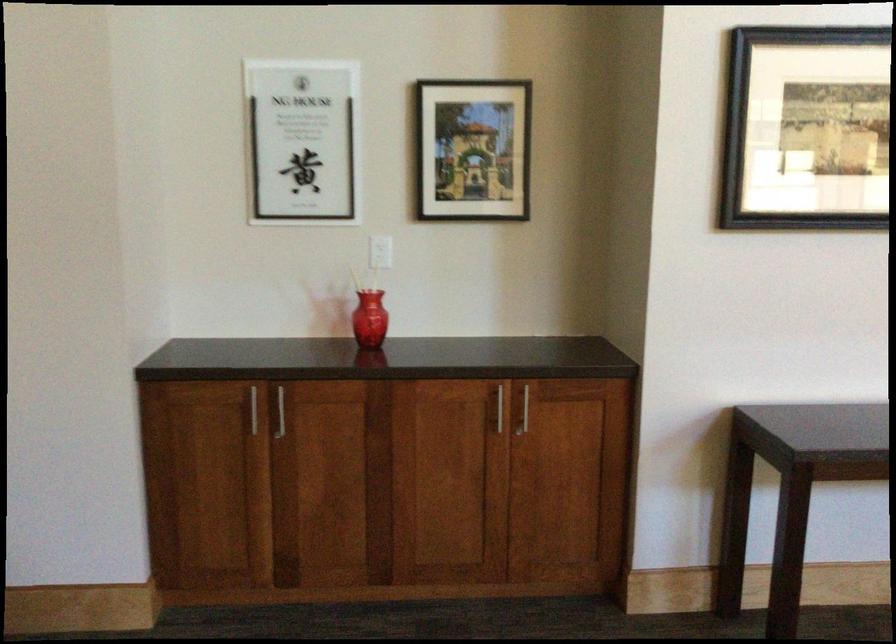
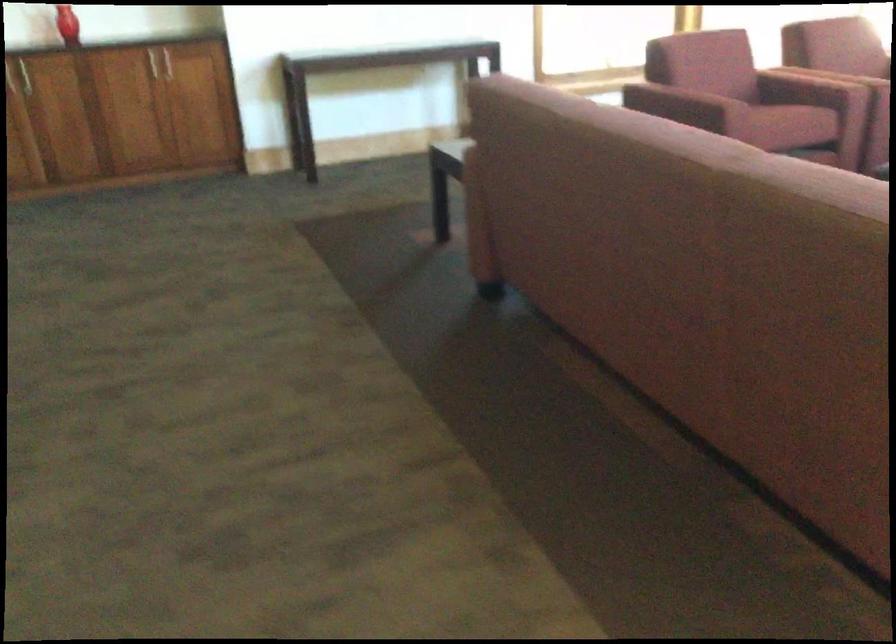
Question: Which direction would the cameraman need to move to produce the second image? Reply with the corresponding letter.

Choices:
 (A) Left
 (B) Right
 (C) Forward
 (D) Backward

Answer: (D)